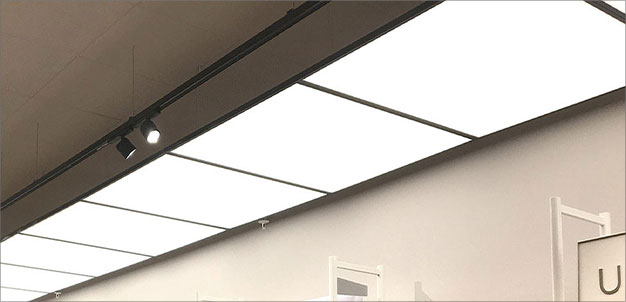
In order to click on racks in this screenshot , I will do `click(352, 263)`, `click(568, 218)`.